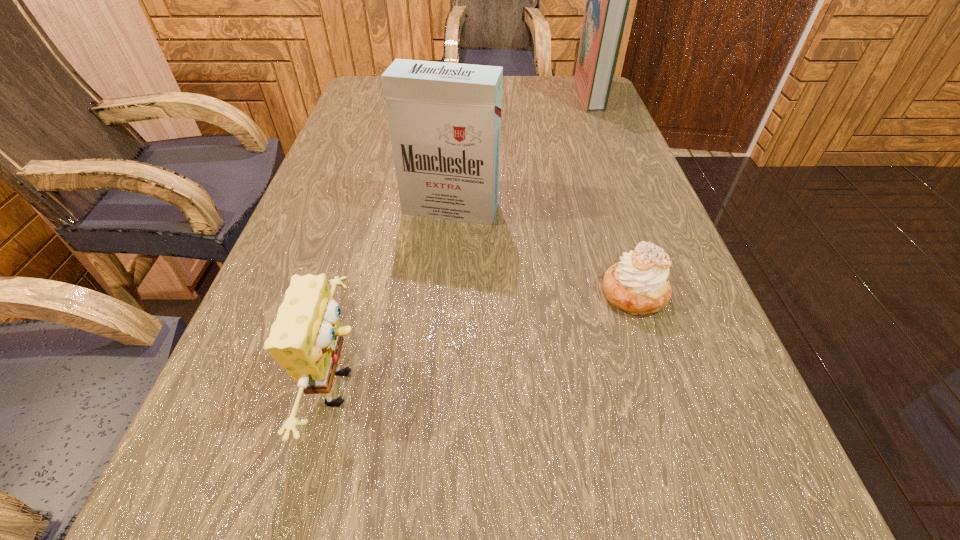
You are a GUI agent. You are given a task and a screenshot of the screen. Output one action in this format:
    pyautogui.click(x=<x>, y=<y>)
    Task: Click on the free space between the second shortest object and the third farthest object
    This screenshot has height=540, width=960.
    Given the screenshot: What is the action you would take?
    coord(489,340)

Find the location of a particular element. The width and height of the screenshot is (960, 540). empty space between the pastry and the sponge is located at coordinates (489, 340).

Identify the location of vacant area between the tallest object and the nearest object. Image resolution: width=960 pixels, height=540 pixels. (467, 240).

Select which object appears as the third closest to the third nearest object. Please provide its 2D coordinates. Your answer should be formatted as a tuple, i.e. [(x, y)], where the tuple contains the x and y coordinates of a point satisfying the conditions above.

[(607, 0)]

Identify which object is located as the second nearest to the sponge. Please provide its 2D coordinates. Your answer should be formatted as a tuple, i.e. [(x, y)], where the tuple contains the x and y coordinates of a point satisfying the conditions above.

[(639, 284)]

Where is `vacant space that satisfies the following two spatial constraints: 1. on the front side of the pastry; 2. on the left side of the second tallest object`? The height and width of the screenshot is (540, 960). vacant space that satisfies the following two spatial constraints: 1. on the front side of the pastry; 2. on the left side of the second tallest object is located at coordinates (444, 293).